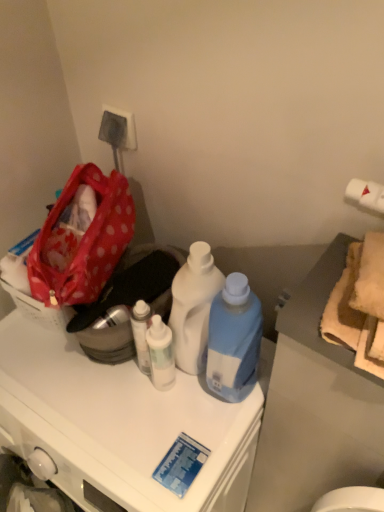
The height and width of the screenshot is (512, 384). What do you see at coordinates (39, 309) in the screenshot? I see `polka dot fabric picnic basket at left` at bounding box center [39, 309].

Where is `white glossy cabinet at center`? The image size is (384, 512). white glossy cabinet at center is located at coordinates (122, 423).

Locate an element on the screen. white glossy bottle at center, which ranks as the 1th bottle in left-to-right order is located at coordinates (161, 354).

How much space does blue plastic bottle at center, which is counted as the third bottle, starting from the left, occupy horizontally?

It is 5.29 inches.

Describe the element at coordinates (234, 339) in the screenshot. The image size is (384, 512). I see `blue plastic bottle at center, which is counted as the third bottle, starting from the left` at that location.

What are the coordinates of `polka dot fabric picnic basket at left` in the screenshot? It's located at (39, 309).

In the image, is white glossy cabinet at center positioned in front of or behind white glossy bottle at center, acting as the 3th bottle starting from the right?

white glossy cabinet at center is positioned closer to the viewer than white glossy bottle at center, acting as the 3th bottle starting from the right.

Considering the positions of objects white glossy cabinet at center and white glossy bottle at center, acting as the 3th bottle starting from the right, in the image provided, who is more to the left, white glossy cabinet at center or white glossy bottle at center, acting as the 3th bottle starting from the right,?

white glossy cabinet at center.

Does point (2, 433) appear closer or farther from the camera than point (174, 359)?

Point (2, 433).

Considering the sizes of objects blue plastic bottle at center, which is counted as the third bottle, starting from the left, and white glossy cabinet at center in the image provided, who is shorter, blue plastic bottle at center, which is counted as the third bottle, starting from the left, or white glossy cabinet at center?

blue plastic bottle at center, which is counted as the third bottle, starting from the left.

Which of these two, blue plastic bottle at center, the 1th bottle when ordered from right to left, or white glossy cabinet at center, is bigger?

white glossy cabinet at center.

Based on their positions, is blue plastic bottle at center, the 1th bottle when ordered from right to left, located to the left or right of white glossy cabinet at center?

From the image, it's evident that blue plastic bottle at center, the 1th bottle when ordered from right to left, is to the right of white glossy cabinet at center.

From a real-world perspective, relative to white glossy cabinet at center, is polka dot fabric picnic basket at left vertically above or below?

Clearly, from a real-world perspective, polka dot fabric picnic basket at left is above white glossy cabinet at center.

Considering the sizes of objects polka dot fabric picnic basket at left and white glossy cabinet at center in the image provided, who is shorter, polka dot fabric picnic basket at left or white glossy cabinet at center?

With less height is polka dot fabric picnic basket at left.

Is polka dot fabric picnic basket at left positioned beyond the bounds of white glossy cabinet at center?

Absolutely, polka dot fabric picnic basket at left is external to white glossy cabinet at center.

Considering the relative sizes of polka dot fabric picnic basket at left and white glossy cabinet at center in the image provided, is polka dot fabric picnic basket at left smaller than white glossy cabinet at center?

Yes, polka dot fabric picnic basket at left is smaller than white glossy cabinet at center.

From a real-world perspective, is white plastic bottle at center, marked as the second bottle in a right-to-left arrangement, physically located above or below blue plastic bottle at center, which is counted as the third bottle, starting from the left?

From a real-world perspective, white plastic bottle at center, marked as the second bottle in a right-to-left arrangement, is physically below blue plastic bottle at center, which is counted as the third bottle, starting from the left.

From the image's perspective, is white plastic bottle at center, acting as the second bottle starting from the left, on blue plastic bottle at center, the 1th bottle when ordered from right to left?

Yes, from the image's perspective, white plastic bottle at center, acting as the second bottle starting from the left, is above blue plastic bottle at center, the 1th bottle when ordered from right to left.

From the blue plastic bottle at center, which is counted as the third bottle, starting from the left, count the 1st bottle to the left and point to it. Please provide its 2D coordinates.

[(193, 307)]

Is white plastic bottle at center, acting as the second bottle starting from the left, surrounding blue plastic bottle at center, which is counted as the third bottle, starting from the left?

That's incorrect, blue plastic bottle at center, which is counted as the third bottle, starting from the left, is not inside white plastic bottle at center, acting as the second bottle starting from the left.

How far apart are red polka dot fabric bag at left and blue plastic bottle at center, which is counted as the third bottle, starting from the left?

A distance of 30.71 centimeters exists between red polka dot fabric bag at left and blue plastic bottle at center, which is counted as the third bottle, starting from the left.

Can you confirm if red polka dot fabric bag at left is positioned to the right of blue plastic bottle at center, which is counted as the third bottle, starting from the left?

In fact, red polka dot fabric bag at left is to the left of blue plastic bottle at center, which is counted as the third bottle, starting from the left.

Can you see red polka dot fabric bag at left touching blue plastic bottle at center, the 1th bottle when ordered from right to left?

No, red polka dot fabric bag at left is not making contact with blue plastic bottle at center, the 1th bottle when ordered from right to left.

In order to click on handbag above the blue plastic bottle at center, which is counted as the third bottle, starting from the left (from the image's perspective) in this screenshot , I will do `click(86, 240)`.

Which is behind, point (251, 293) or point (54, 312)?

The point (54, 312) is farther.

From a real-world perspective, who is located lower, blue plastic bottle at center, the 1th bottle when ordered from right to left, or polka dot fabric picnic basket at left?

From a 3D spatial view, polka dot fabric picnic basket at left is below.

Between blue plastic bottle at center, the 1th bottle when ordered from right to left, and polka dot fabric picnic basket at left, which one has larger width?

With larger width is blue plastic bottle at center, the 1th bottle when ordered from right to left.

Is blue plastic bottle at center, which is counted as the third bottle, starting from the left, beside polka dot fabric picnic basket at left?

No.

Image resolution: width=384 pixels, height=512 pixels. What are the coordinates of `cabinetry directly beneath the white glossy bottle at center, which ranks as the 1th bottle in left-to-right order (from a real-world perspective)` in the screenshot? It's located at (122, 423).

How different are the orientations of white glossy bottle at center, which ranks as the 1th bottle in left-to-right order, and white glossy cabinet at center in degrees?

There is a 0.00272-degree angle between the facing directions of white glossy bottle at center, which ranks as the 1th bottle in left-to-right order, and white glossy cabinet at center.

From the picture: Considering the sizes of objects white glossy bottle at center, which ranks as the 1th bottle in left-to-right order, and white glossy cabinet at center in the image provided, who is smaller, white glossy bottle at center, which ranks as the 1th bottle in left-to-right order, or white glossy cabinet at center?

white glossy bottle at center, which ranks as the 1th bottle in left-to-right order, is smaller.

Could you measure the distance between white glossy bottle at center, which ranks as the 1th bottle in left-to-right order, and white glossy cabinet at center?

A distance of 6.88 inches exists between white glossy bottle at center, which ranks as the 1th bottle in left-to-right order, and white glossy cabinet at center.

The width and height of the screenshot is (384, 512). I want to click on the 1st bottle to the right of the white glossy cabinet at center, counting from the anchor's position, so click(161, 354).

This screenshot has width=384, height=512. Find the location of `cabinetry below the blue plastic bottle at center, which is counted as the third bottle, starting from the left (from the image's perspective)`. cabinetry below the blue plastic bottle at center, which is counted as the third bottle, starting from the left (from the image's perspective) is located at coordinates (122, 423).

When comparing their distances from white plastic bottle at center, marked as the second bottle in a right-to-left arrangement, does polka dot fabric picnic basket at left or white glossy cabinet at center seem closer?

white glossy cabinet at center.

Considering their positions, is blue plastic bottle at center, the 1th bottle when ordered from right to left, positioned further to red polka dot fabric bag at left than white glossy bottle at center, acting as the 3th bottle starting from the right?

blue plastic bottle at center, the 1th bottle when ordered from right to left, is positioned further to the anchor red polka dot fabric bag at left.

Based on their spatial positions, is white plastic bottle at center, acting as the second bottle starting from the left, or white glossy bottle at center, acting as the 3th bottle starting from the right, further from red polka dot fabric bag at left?

The object further to red polka dot fabric bag at left is white glossy bottle at center, acting as the 3th bottle starting from the right.

Based on their spatial positions, is white glossy cabinet at center or white plastic bottle at center, acting as the second bottle starting from the left, further from white glossy bottle at center, which ranks as the 1th bottle in left-to-right order?

The object further to white glossy bottle at center, which ranks as the 1th bottle in left-to-right order, is white glossy cabinet at center.

Looking at the image, which one is located further to white plastic bottle at center, marked as the second bottle in a right-to-left arrangement, red polka dot fabric bag at left or blue plastic bottle at center, the 1th bottle when ordered from right to left?

The object further to white plastic bottle at center, marked as the second bottle in a right-to-left arrangement, is red polka dot fabric bag at left.

Estimate the real-world distances between objects in this image. Which object is further from red polka dot fabric bag at left, blue plastic bottle at center, the 1th bottle when ordered from right to left, or polka dot fabric picnic basket at left?

blue plastic bottle at center, the 1th bottle when ordered from right to left, lies further to red polka dot fabric bag at left than the other object.

When comparing their distances from polka dot fabric picnic basket at left, does red polka dot fabric bag at left or blue plastic bottle at center, the 1th bottle when ordered from right to left, seem further?

Among the two, blue plastic bottle at center, the 1th bottle when ordered from right to left, is located further to polka dot fabric picnic basket at left.

Looking at the image, which one is located closer to white glossy cabinet at center, white plastic bottle at center, acting as the second bottle starting from the left, or polka dot fabric picnic basket at left?

white plastic bottle at center, acting as the second bottle starting from the left, lies closer to white glossy cabinet at center than the other object.

This screenshot has height=512, width=384. What are the coordinates of `handbag between polka dot fabric picnic basket at left and white glossy bottle at center, acting as the 3th bottle starting from the right, from left to right` in the screenshot? It's located at (86, 240).

I want to click on bottle between red polka dot fabric bag at left and white plastic bottle at center, acting as the second bottle starting from the left, in the horizontal direction, so click(161, 354).

I want to click on bottle that lies between blue plastic bottle at center, which is counted as the third bottle, starting from the left, and white glossy cabinet at center from top to bottom, so click(161, 354).

Identify the location of bottle between white glossy bottle at center, which ranks as the 1th bottle in left-to-right order, and blue plastic bottle at center, the 1th bottle when ordered from right to left, from left to right. The image size is (384, 512). (193, 307).